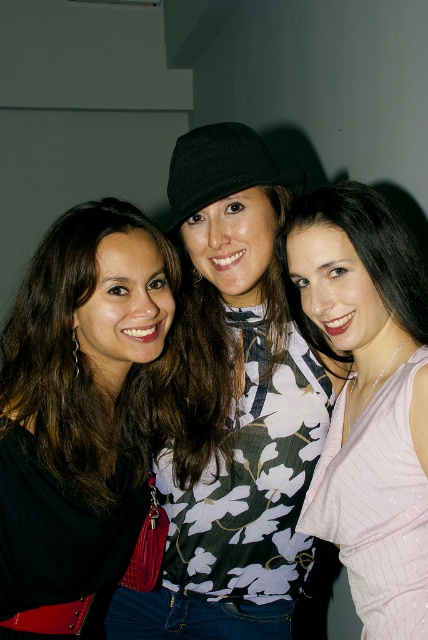
Between point (219, 540) and point (382, 586), which one is positioned in front?

Point (382, 586) is in front.

Between point (107, 611) and point (365, 560), which one is positioned behind?

The point (107, 611) is behind.

This screenshot has height=640, width=428. Find the location of `floral-patterned blouse at center`. floral-patterned blouse at center is located at coordinates (234, 408).

Can you confirm if floral-patterned blouse at center is thinner than black leather purse at left?

No.

Who is taller, floral-patterned blouse at center or black leather purse at left?

floral-patterned blouse at center

The image size is (428, 640). In order to click on floral-patterned blouse at center in this screenshot , I will do (234, 408).

Can you confirm if black leather purse at left is bigger than pink ribbed tank top at center?

Yes, black leather purse at left is bigger than pink ribbed tank top at center.

Is black leather purse at left to the right of pink ribbed tank top at center from the viewer's perspective?

Incorrect, black leather purse at left is not on the right side of pink ribbed tank top at center.

Is point (55, 632) positioned behind point (419, 428)?

Yes.

The image size is (428, 640). In order to click on black leather purse at left in this screenshot , I will do `click(80, 404)`.